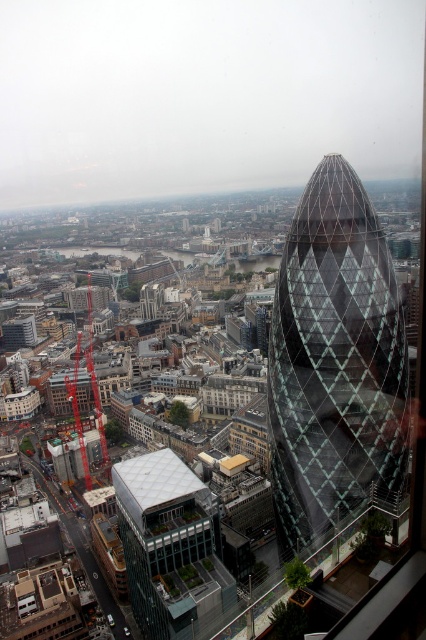
Between transparent glass tower at center right and clear glass windows at center, which one is positioned higher?

transparent glass tower at center right is above.

Which of these two, transparent glass tower at center right or clear glass windows at center, stands shorter?

With less height is clear glass windows at center.

This screenshot has height=640, width=426. What are the coordinates of `transparent glass tower at center right` in the screenshot? It's located at (334, 364).

Find the location of a particular element. Image resolution: width=426 pixels, height=640 pixels. transparent glass tower at center right is located at coordinates (334, 364).